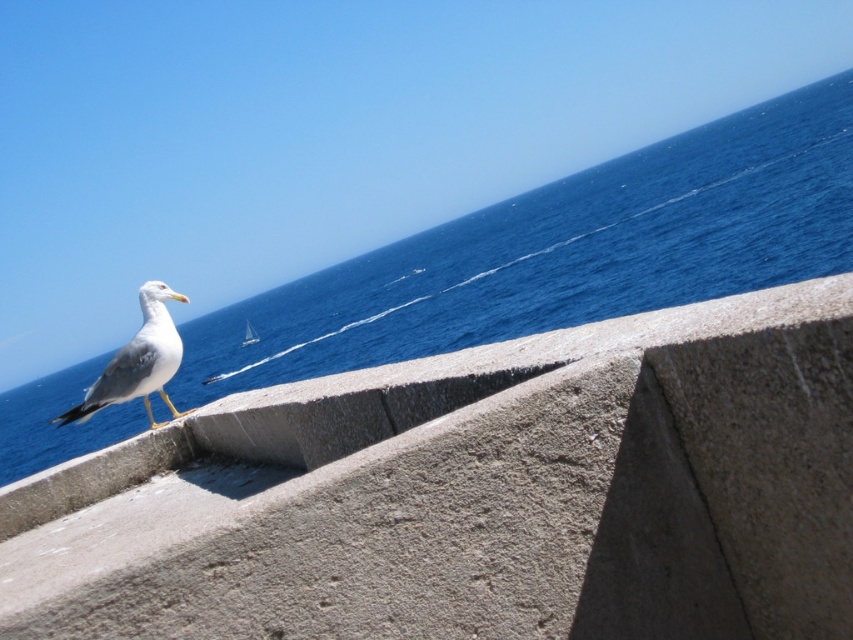
Question: In this image, where is concrete at left located relative to white matte seagull at upper left?

Choices:
 (A) above
 (B) below

Answer: (A)

Question: Which point is farther to the camera?

Choices:
 (A) blue water at upper right
 (B) white matte seagull at upper left
 (C) concrete at left

Answer: (A)

Question: Does concrete at left appear on the left side of white matte seagull at upper left?

Choices:
 (A) no
 (B) yes

Answer: (A)

Question: Which object is the farthest from the blue water at upper right?

Choices:
 (A) concrete at left
 (B) white matte seagull at upper left

Answer: (B)

Question: Can you confirm if concrete at left is wider than blue water at upper right?

Choices:
 (A) no
 (B) yes

Answer: (A)

Question: Which object is positioned closest to the blue water at upper right?

Choices:
 (A) concrete at left
 (B) white matte seagull at upper left

Answer: (A)